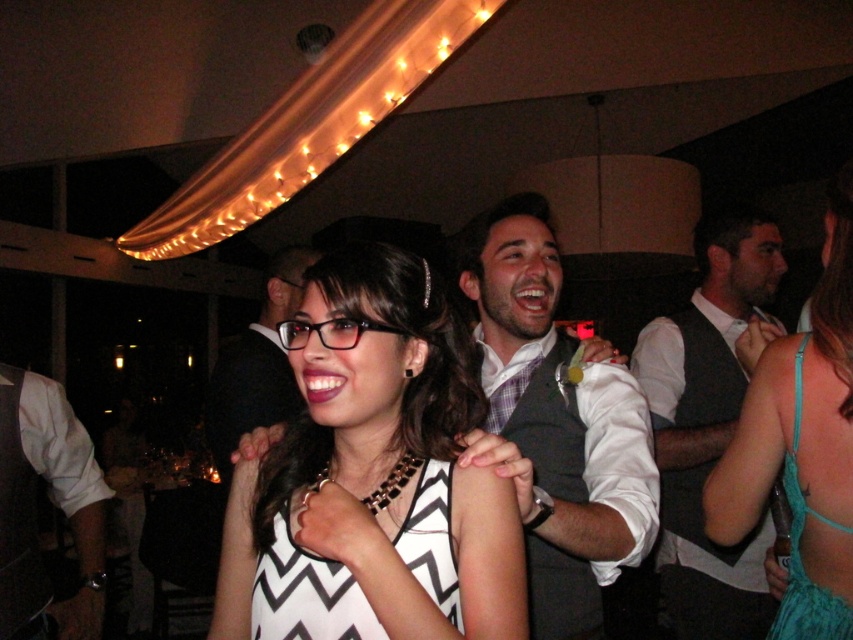
In the image of the lively indoor gathering with string lights, where exactly is the teal satin dress at right located?

The teal satin dress at right is located at point 0.697 on the x axis and 0.940 on the y axis.